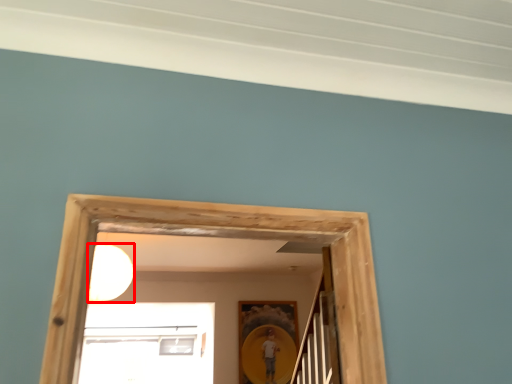
Question: From the image, what is the correct spatial relationship of light (annotated by the red box) in relation to picture frame?

Choices:
 (A) left
 (B) right

Answer: (A)